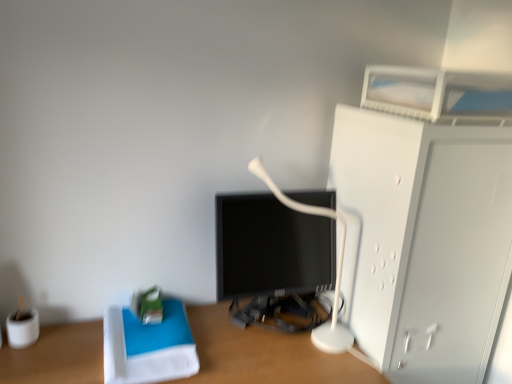
Find the location of `wooden desk at center`. wooden desk at center is located at coordinates (265, 354).

This screenshot has height=384, width=512. What are the coordinates of `white plastic table lamp at center` in the screenshot? It's located at (336, 270).

At what (x,y) coordinates should I click in order to perform the action: click on wooden desk at center. Please return your answer as a coordinate pair (x, y). Looking at the image, I should click on (265, 354).

Is white matte cabinet at right positioned beyond the bounds of white plastic table lamp at center?

white matte cabinet at right is positioned outside white plastic table lamp at center.

From the picture: Which object is closer to the camera, white matte cabinet at right or white plastic table lamp at center?

white matte cabinet at right is closer to the camera.

From the image's perspective, between white matte cabinet at right and white plastic table lamp at center, which one is located above?

white plastic table lamp at center.

Considering the points (405, 323) and (250, 170), which point is behind, point (405, 323) or point (250, 170)?

The point (250, 170) is behind.

From the image's perspective, is white matte cabinet at right on top of wooden desk at center?

Yes, from the image's perspective, white matte cabinet at right is above wooden desk at center.

You are a GUI agent. You are given a task and a screenshot of the screen. Output one action in this format:
    pyautogui.click(x=<x>, y=<y>)
    Task: Click on the furniture behind the wooden desk at center
    The image size is (512, 384).
    Given the screenshot: What is the action you would take?
    pyautogui.click(x=423, y=241)

Do you think white matte cabinet at right is within wooden desk at center, or outside of it?

The correct answer is: outside.

Does white matte cabinet at right lie behind wooden desk at center?

Yes, the depth of white matte cabinet at right is greater than that of wooden desk at center.

From the image's perspective, does wooden desk at center appear higher than white plastic table lamp at center?

No.

Can you confirm if wooden desk at center is positioned to the right of white plastic table lamp at center?

No, wooden desk at center is not to the right of white plastic table lamp at center.

Is white plastic table lamp at center at the back of wooden desk at center?

That's not correct — wooden desk at center is not looking away from white plastic table lamp at center.

Image resolution: width=512 pixels, height=384 pixels. Find the location of `table lamp to the right of wooden desk at center`. table lamp to the right of wooden desk at center is located at coordinates click(x=336, y=270).

Does wooden desk at center have a greater height compared to white matte cabinet at right?

No.

This screenshot has width=512, height=384. Identify the location of desk below the white matte cabinet at right (from a real-world perspective). (265, 354).

Can you confirm if wooden desk at center is wider than white matte cabinet at right?

Yes.

Who is bigger, wooden desk at center or white matte cabinet at right?

wooden desk at center is bigger.

From the image's perspective, is white plastic table lamp at center located above or below wooden desk at center?

white plastic table lamp at center is above wooden desk at center.

Considering the relative sizes of white plastic table lamp at center and wooden desk at center in the image provided, is white plastic table lamp at center bigger than wooden desk at center?

No.

In the scene shown: From a real-world perspective, is white plastic table lamp at center positioned under wooden desk at center based on gravity?

Actually, white plastic table lamp at center is physically above wooden desk at center in the real world.

Between point (335, 313) and point (84, 367), which one is positioned behind?

The point (335, 313) is farther from the camera.

Who is smaller, white plastic table lamp at center or white matte cabinet at right?

With smaller size is white plastic table lamp at center.

Which is more to the right, white plastic table lamp at center or white matte cabinet at right?

white matte cabinet at right.

Between point (338, 329) and point (453, 155), which one is positioned in front?

Positioned in front is point (453, 155).

Is white matte cabinet at right surrounded by white plastic table lamp at center?

Actually, white matte cabinet at right is outside white plastic table lamp at center.

Locate an element on the screen. furniture on the right side of white plastic table lamp at center is located at coordinates (423, 241).

Find the location of a particular element. The image size is (512, 384). furniture above the wooden desk at center (from the image's perspective) is located at coordinates (423, 241).

When comparing their distances from white plastic table lamp at center, does white matte cabinet at right or wooden desk at center seem closer?

white matte cabinet at right lies closer to white plastic table lamp at center than the other object.

Based on their spatial positions, is white plastic table lamp at center or white matte cabinet at right closer to wooden desk at center?

Based on the image, white plastic table lamp at center appears to be nearer to wooden desk at center.

From the image, which object appears to be nearer to white matte cabinet at right, wooden desk at center or white plastic table lamp at center?

Based on the image, white plastic table lamp at center appears to be nearer to white matte cabinet at right.

When comparing their distances from wooden desk at center, does white matte cabinet at right or white plastic table lamp at center seem further?

Among the two, white matte cabinet at right is located further to wooden desk at center.

From the image, which object appears to be farther from white matte cabinet at right, white plastic table lamp at center or wooden desk at center?

The object further to white matte cabinet at right is wooden desk at center.

From the image, which object appears to be nearer to white plastic table lamp at center, wooden desk at center or white matte cabinet at right?

The object closer to white plastic table lamp at center is white matte cabinet at right.

Find the location of a particular element. table lamp between wooden desk at center and white matte cabinet at right from left to right is located at coordinates (336, 270).